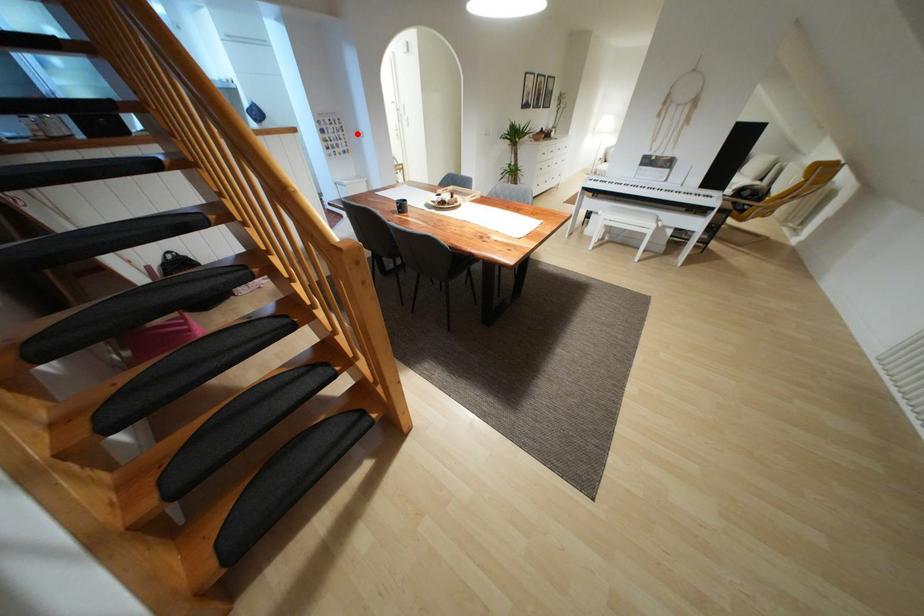
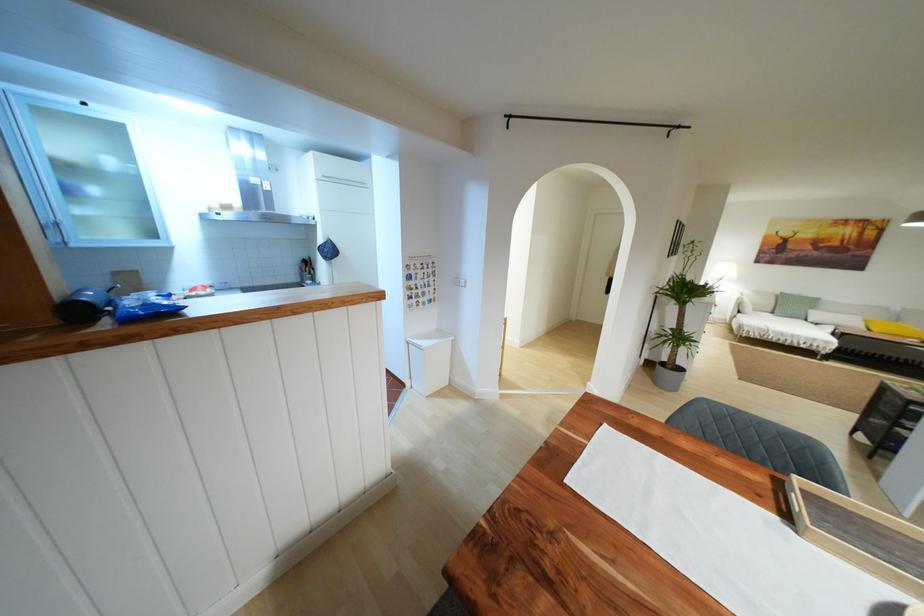
Locate, in the second image, the point that corresponds to the highlighted location in the first image.

(456, 282)